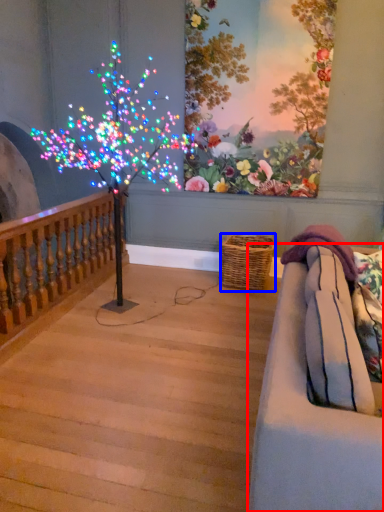
Question: Among these objects, which one is farthest to the camera, studio couch (highlighted by a red box) or basket (highlighted by a blue box)?

Choices:
 (A) studio couch
 (B) basket

Answer: (B)